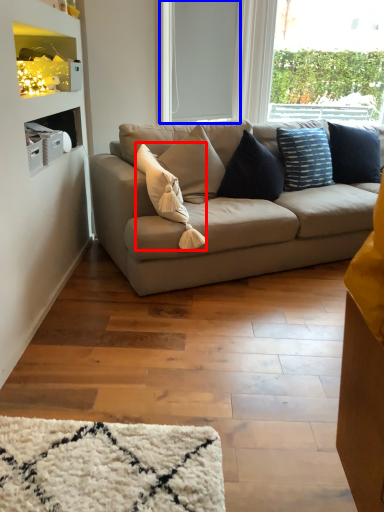
Question: Which object appears farthest to the camera in this image, pillow (highlighted by a red box) or window screen (highlighted by a blue box)?

Choices:
 (A) pillow
 (B) window screen

Answer: (B)